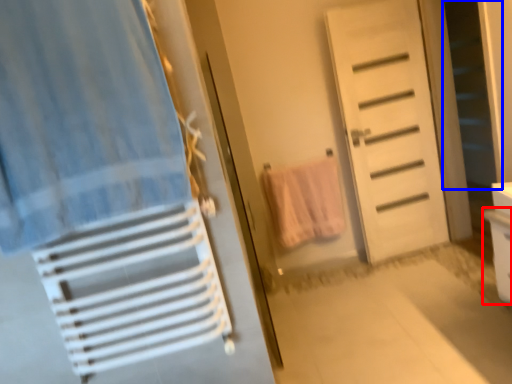
Question: Which of the following is the farthest to the observer, drawer (highlighted by a red box) or screen door (highlighted by a blue box)?

Choices:
 (A) drawer
 (B) screen door

Answer: (B)